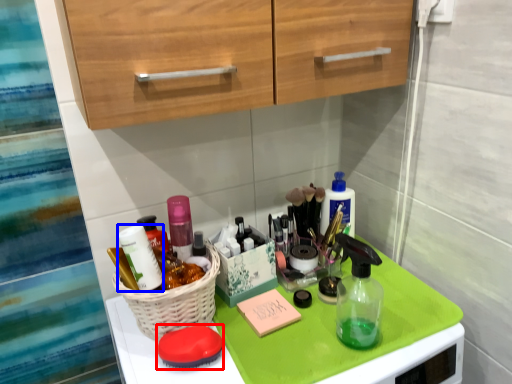
Question: Which point is closer to the camera, soap (highlighted by a red box) or toiletry (highlighted by a blue box)?

Choices:
 (A) soap
 (B) toiletry

Answer: (A)